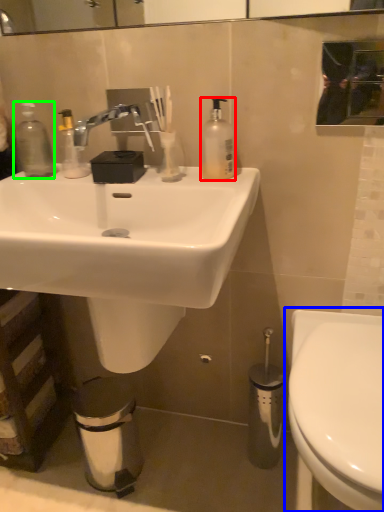
Question: Estimate the real-world distances between objects in this image. Which object is farther from soap dispenser (highlighted by a red box), toilet (highlighted by a blue box) or bottle (highlighted by a green box)?

Choices:
 (A) toilet
 (B) bottle

Answer: (A)